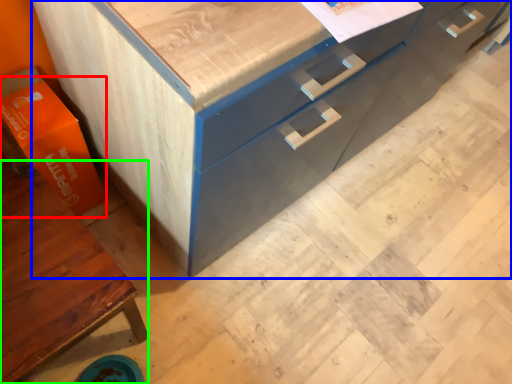
Question: Which is farther away from cardboard box (highlighted by a red box)? chest of drawers (highlighted by a blue box) or cabinetry (highlighted by a green box)?

Choices:
 (A) chest of drawers
 (B) cabinetry

Answer: (A)